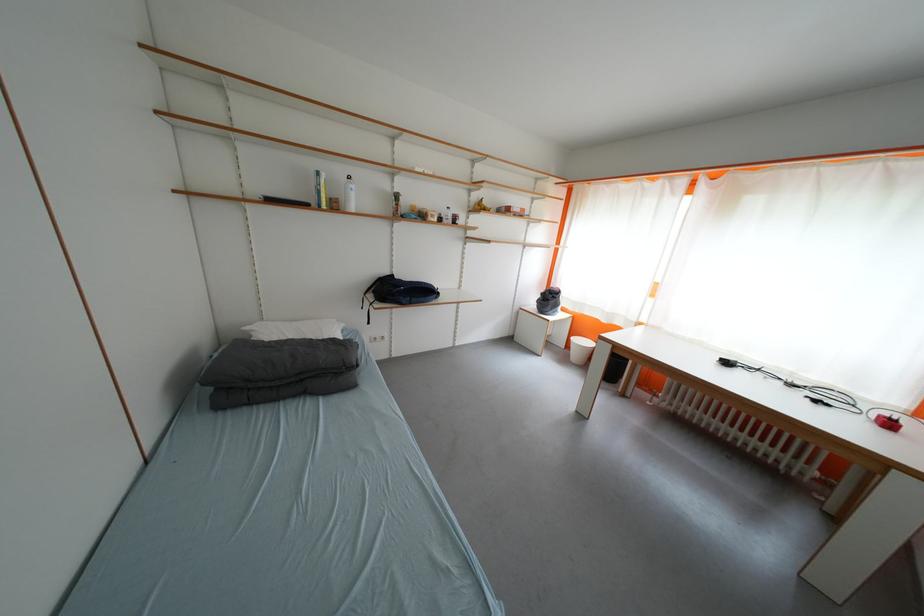
Describe the element at coordinates (398, 292) in the screenshot. I see `the blue backpack` at that location.